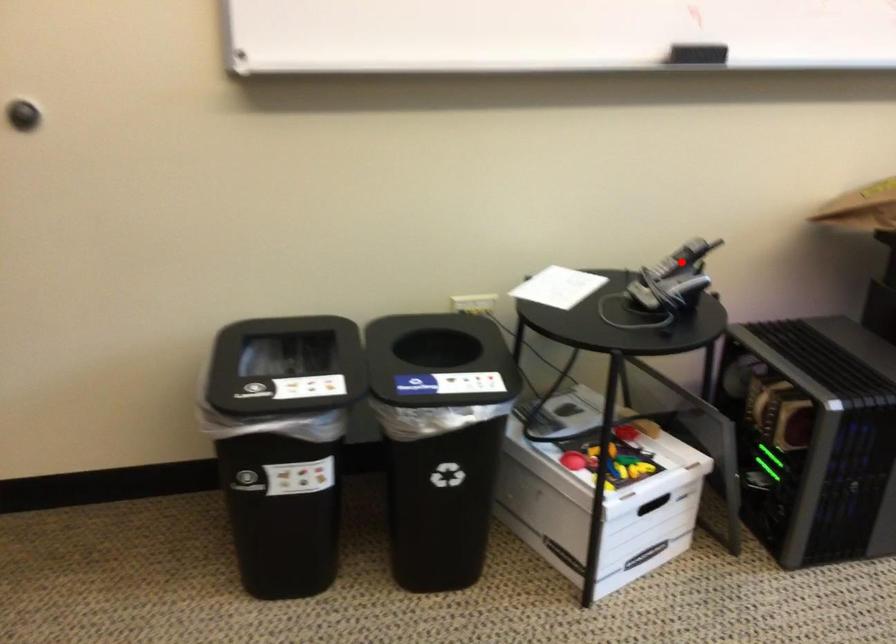
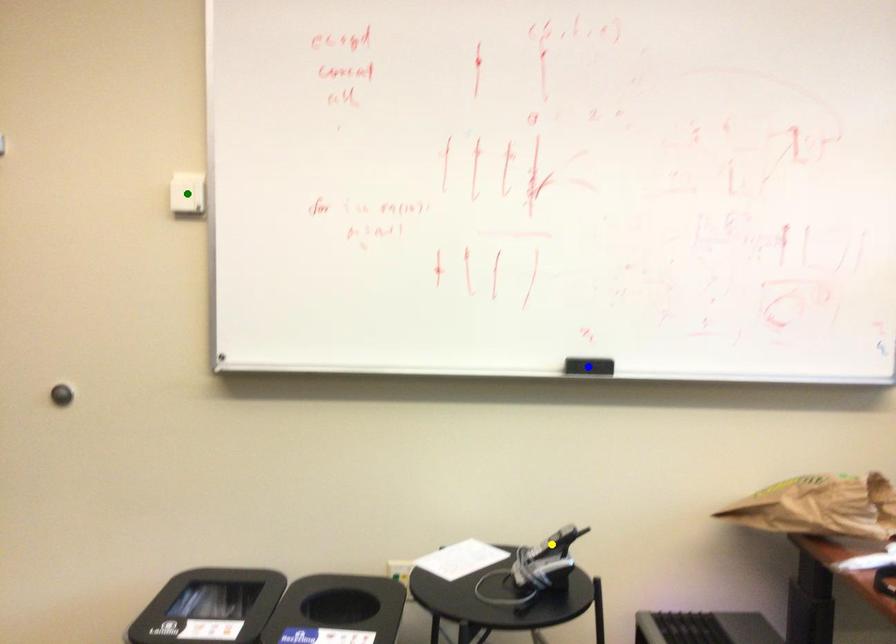
Question: I am providing you with two images of the same scene from different viewpoints. A red point is marked on the first image. You are given multiple points on the second image. Which point in image 2 represents the same 3d spot as the red point in image 1?

Choices:
 (A) yellow point
 (B) blue point
 (C) green point

Answer: (A)